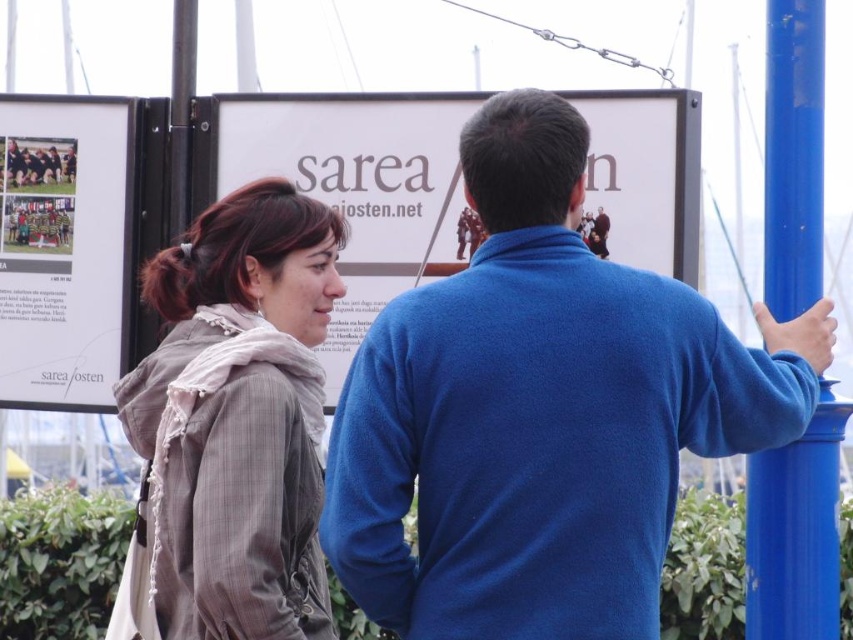
You are an event organizer who needs to hang a new poster that is 2 meters wide. You observe the white paper poster at center and the blue metallic pole at right in the scene. Based on their widths, can you determine if the new poster will fit between them without overlapping?

The white paper poster at center is wider than the blue metallic pole at right. Since the new poster is 2 meters wide, you need to measure the distance between them first to ensure it can fit without overlapping.

You are an artist trying to sketch the scene. You notice two elements in the image, the white paper at upper left and the blue metallic pole at right. Which of these two items takes up more space in the image?

The blue metallic pole at right takes up more space in the image because the white paper at upper left occupies less space than it.

You are a delivery person who needs to hang a 1.5 meter tall package on the blue metallic pole at right. The white paper poster at center is currently blocking the lower half of the pole. Can you hang the package there without moving the poster?

The white paper poster at center is not as tall as blue metallic pole at right, so there is enough space above the poster to hang the 1.5 meter tall package on the blue metallic pole at right without moving the poster.